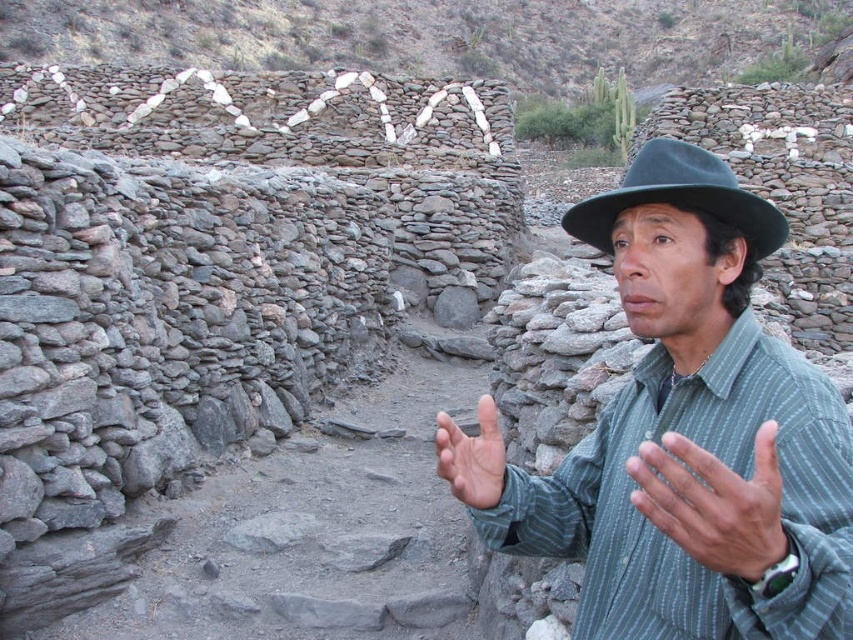
Question: Based on their relative distances, which object is nearer to the black felt fedora at center?

Choices:
 (A) green striped shirt at center
 (B) gray striped shirt at lower right

Answer: (A)

Question: Which is farther from the smooth skin hand at center?

Choices:
 (A) green striped shirt at center
 (B) black felt fedora at center

Answer: (B)

Question: Can you confirm if black felt fedora at center is smaller than smooth skin hand at center?

Choices:
 (A) no
 (B) yes

Answer: (B)

Question: Which object is positioned farthest from the smooth skin hand at center?

Choices:
 (A) black felt fedora at center
 (B) green striped shirt at center

Answer: (A)

Question: Is black felt fedora at center wider than smooth skin hand at center?

Choices:
 (A) yes
 (B) no

Answer: (A)

Question: Is green striped shirt at center thinner than black felt fedora at center?

Choices:
 (A) yes
 (B) no

Answer: (B)